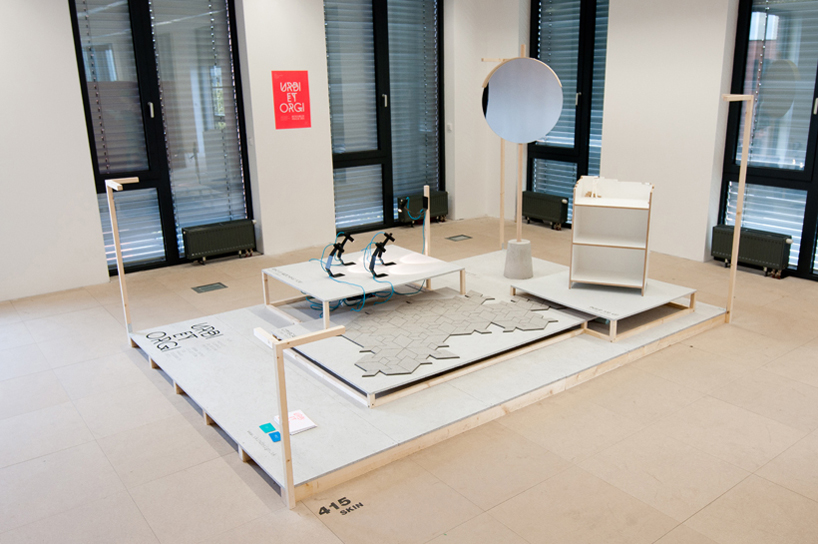
The width and height of the screenshot is (818, 544). Find the location of `shorter table legs`. shorter table legs is located at coordinates (614, 325), (511, 288), (690, 298).